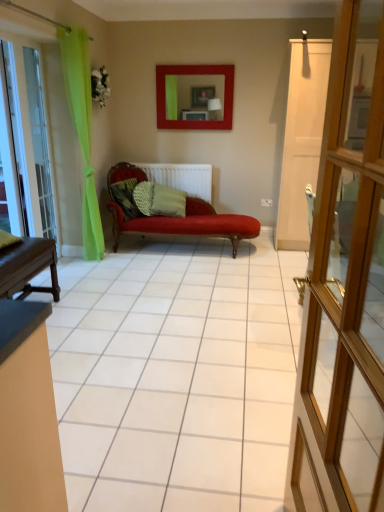
Question: Is clear glass door at left inside the boundaries of white wooden door at center, or outside?

Choices:
 (A) outside
 (B) inside

Answer: (A)

Question: Looking at the image, does clear glass door at left seem bigger or smaller compared to white wooden door at center?

Choices:
 (A) small
 (B) big

Answer: (A)

Question: Which object is the closest to the clear glass door at left?

Choices:
 (A) camouflage fabric pillow at center, the 2th pillow positioned from the right
 (B) green textured pillow at center, which is counted as the 1th pillow, starting from the right
 (C) white matte radiator at center
 (D) transparent glass door at left
 (E) matte red picture frame at upper center

Answer: (D)

Question: Considering the real-world distances, which object is closest to the transparent glass door at left?

Choices:
 (A) white wooden door at center
 (B) clear glass door at left
 (C) matte red picture frame at upper center
 (D) camouflage fabric pillow at center, the 2th pillow positioned from the right
 (E) green textured pillow at center, the 2th pillow viewed from the left

Answer: (B)